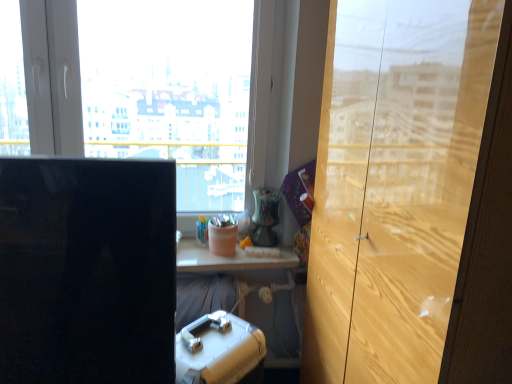
Question: From a real-world perspective, is black glossy computer monitor at left physically below transparent glass window at center?

Choices:
 (A) yes
 (B) no

Answer: (A)

Question: Are black glossy computer monitor at left and transparent glass window at center far apart?

Choices:
 (A) yes
 (B) no

Answer: (B)

Question: From a real-world perspective, is black glossy computer monitor at left over transparent glass window at center?

Choices:
 (A) yes
 (B) no

Answer: (B)

Question: Is black glossy computer monitor at left facing towards transparent glass window at center?

Choices:
 (A) no
 (B) yes

Answer: (A)

Question: Can you confirm if black glossy computer monitor at left is smaller than transparent glass window at center?

Choices:
 (A) no
 (B) yes

Answer: (A)

Question: Is black glossy computer monitor at left wider than transparent glass window at center?

Choices:
 (A) yes
 (B) no

Answer: (A)

Question: Is wooden cabinet at right at the left side of transparent glass window at center?

Choices:
 (A) yes
 (B) no

Answer: (B)

Question: Is transparent glass window at center surrounded by wooden cabinet at right?

Choices:
 (A) no
 (B) yes

Answer: (A)

Question: Is wooden cabinet at right facing towards transparent glass window at center?

Choices:
 (A) yes
 (B) no

Answer: (B)

Question: Is wooden cabinet at right next to transparent glass window at center?

Choices:
 (A) no
 (B) yes

Answer: (A)

Question: Is wooden cabinet at right closer to the viewer compared to transparent glass window at center?

Choices:
 (A) no
 (B) yes

Answer: (B)

Question: Is wooden cabinet at right to the right of transparent glass window at center from the viewer's perspective?

Choices:
 (A) no
 (B) yes

Answer: (B)

Question: From the image's perspective, would you say pink matte container at center, the 2th stationery when ordered from top to bottom, is positioned over black glossy computer monitor at left?

Choices:
 (A) yes
 (B) no

Answer: (A)